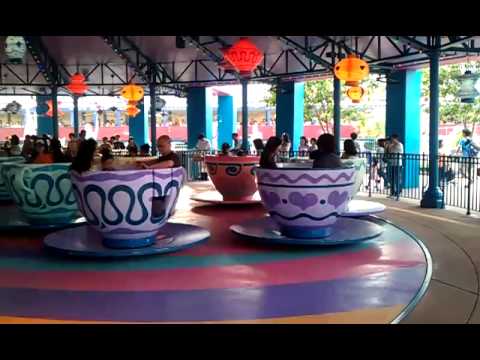
Where is `green stripe pattern on floor`? green stripe pattern on floor is located at coordinates (250, 258), (143, 261), (31, 262).